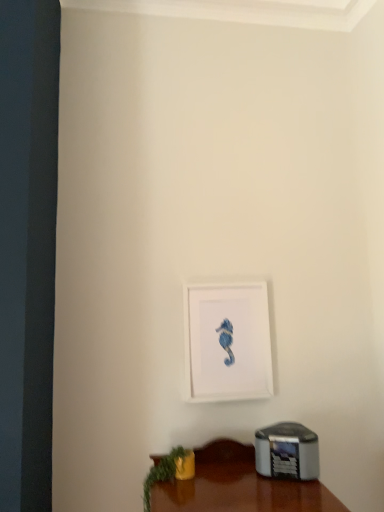
Question: Considering the relative sizes of green leafy plant at lower left and white matte picture frame at center in the image provided, is green leafy plant at lower left smaller than white matte picture frame at center?

Choices:
 (A) yes
 (B) no

Answer: (A)

Question: From the image's perspective, is green leafy plant at lower left above white matte picture frame at center?

Choices:
 (A) yes
 (B) no

Answer: (B)

Question: Can you confirm if green leafy plant at lower left is wider than white matte picture frame at center?

Choices:
 (A) yes
 (B) no

Answer: (A)

Question: Is green leafy plant at lower left outside of white matte picture frame at center?

Choices:
 (A) no
 (B) yes

Answer: (B)

Question: Can you confirm if green leafy plant at lower left is taller than white matte picture frame at center?

Choices:
 (A) yes
 (B) no

Answer: (B)

Question: Is green leafy plant at lower left far away from white matte picture frame at center?

Choices:
 (A) no
 (B) yes

Answer: (A)

Question: Is white matte picture frame at center oriented towards green leafy plant at lower left?

Choices:
 (A) no
 (B) yes

Answer: (A)

Question: Can you confirm if white matte picture frame at center is thinner than green leafy plant at lower left?

Choices:
 (A) no
 (B) yes

Answer: (B)

Question: Does white matte picture frame at center appear on the right side of green leafy plant at lower left?

Choices:
 (A) no
 (B) yes

Answer: (B)

Question: Does white matte picture frame at center have a smaller size compared to green leafy plant at lower left?

Choices:
 (A) yes
 (B) no

Answer: (B)

Question: From a real-world perspective, is white matte picture frame at center on green leafy plant at lower left?

Choices:
 (A) no
 (B) yes

Answer: (B)

Question: From the image's perspective, is white matte picture frame at center below green leafy plant at lower left?

Choices:
 (A) yes
 (B) no

Answer: (B)

Question: From the image's perspective, relative to green leafy plant at lower left, is white matte picture frame at center above or below?

Choices:
 (A) below
 (B) above

Answer: (B)